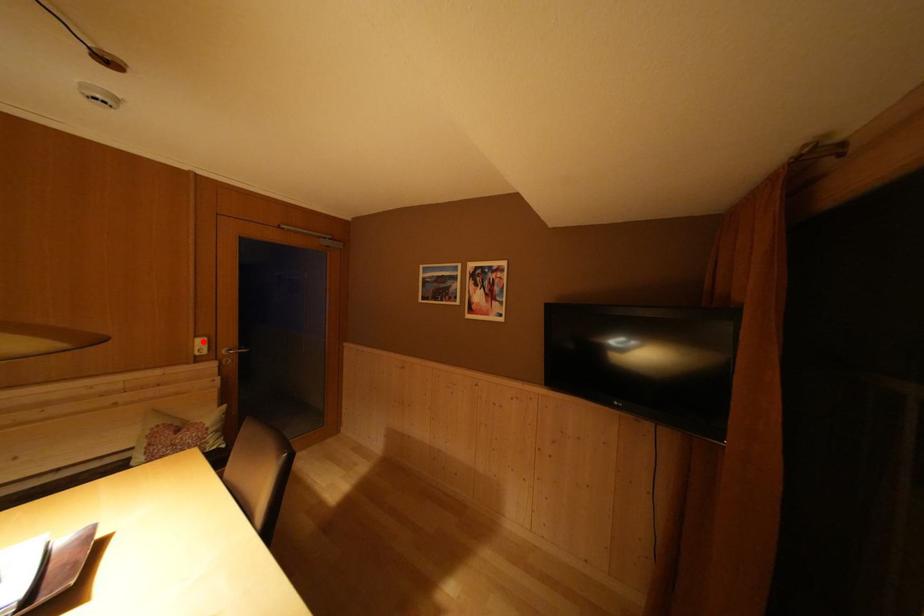
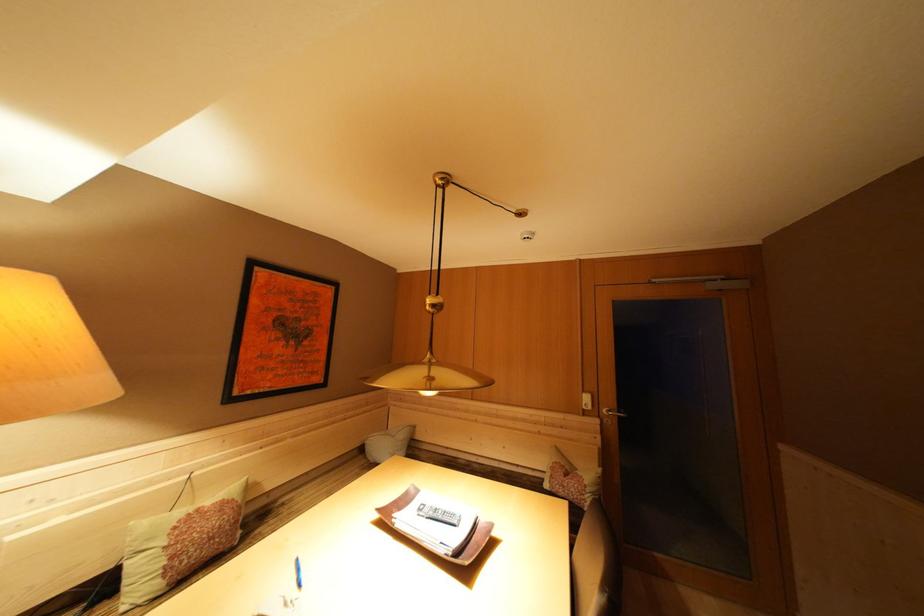
In the second image, find the point that corresponds to the highlighted location in the first image.

(590, 397)